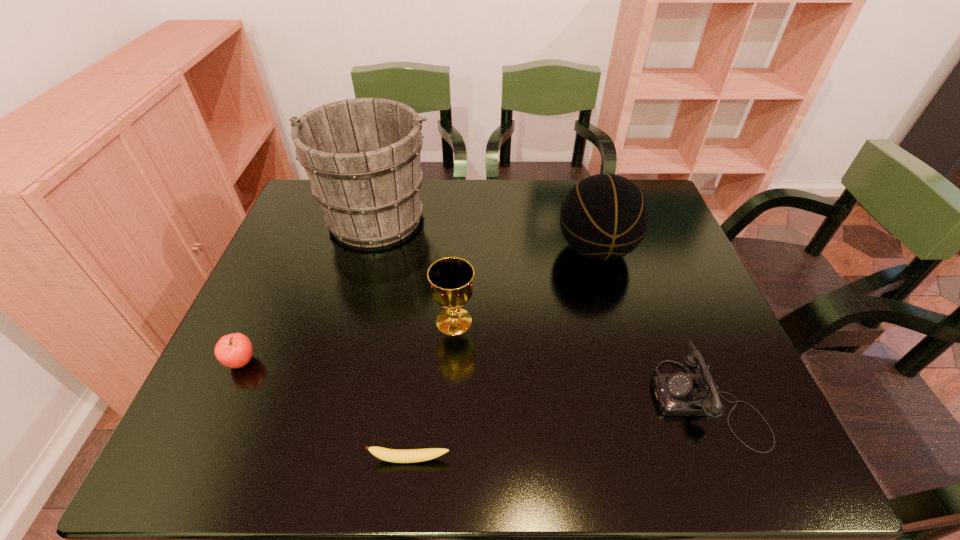
Identify the location of object located at the far left corner. (362, 156).

Find the location of a particular element. This screenshot has height=540, width=960. object present at the near right corner is located at coordinates (677, 394).

The image size is (960, 540). Find the location of `free spot at the far edge of the desktop`. free spot at the far edge of the desktop is located at coordinates (453, 199).

The width and height of the screenshot is (960, 540). What are the coordinates of `vacant space at the near edge of the desktop` in the screenshot? It's located at (434, 444).

In the image, there is a desktop. What are the coordinates of `vacant space at the left edge` in the screenshot? It's located at (276, 327).

Locate an element on the screen. vacant area at the right edge of the desktop is located at coordinates (666, 236).

Where is `free space between the tallest object and the leftmost object`? free space between the tallest object and the leftmost object is located at coordinates (309, 289).

Locate an element on the screen. unoccupied area between the basketball and the telephone is located at coordinates (651, 325).

Identify the location of free space between the bucket and the second tallest object. (486, 233).

Image resolution: width=960 pixels, height=540 pixels. Find the location of `vacant area between the telephone and the leftmost object`. vacant area between the telephone and the leftmost object is located at coordinates (473, 381).